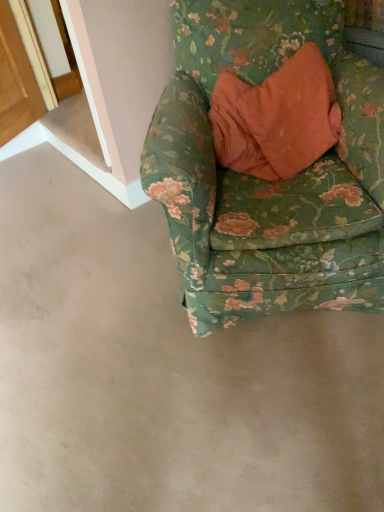
Question: Should I look upward or downward to see floral fabric chair at upper right?

Choices:
 (A) up
 (B) down

Answer: (A)

Question: Does gray concrete at lower center have a larger size compared to floral fabric chair at upper right?

Choices:
 (A) yes
 (B) no

Answer: (B)

Question: Is gray concrete at lower center shorter than floral fabric chair at upper right?

Choices:
 (A) yes
 (B) no

Answer: (A)

Question: Does gray concrete at lower center come in front of floral fabric chair at upper right?

Choices:
 (A) yes
 (B) no

Answer: (A)

Question: Is gray concrete at lower center looking in the opposite direction of floral fabric chair at upper right?

Choices:
 (A) no
 (B) yes

Answer: (A)

Question: From the image's perspective, does gray concrete at lower center appear higher than floral fabric chair at upper right?

Choices:
 (A) no
 (B) yes

Answer: (A)

Question: Can you confirm if gray concrete at lower center is positioned to the left of floral fabric chair at upper right?

Choices:
 (A) no
 (B) yes

Answer: (B)

Question: Would you say floral fabric chair at upper right is outside gray concrete at lower center?

Choices:
 (A) yes
 (B) no

Answer: (A)

Question: From a real-world perspective, is floral fabric chair at upper right physically above gray concrete at lower center?

Choices:
 (A) no
 (B) yes

Answer: (B)

Question: Would you say floral fabric chair at upper right is a long distance from gray concrete at lower center?

Choices:
 (A) yes
 (B) no

Answer: (B)

Question: From the image's perspective, is floral fabric chair at upper right over gray concrete at lower center?

Choices:
 (A) yes
 (B) no

Answer: (A)

Question: Can you confirm if floral fabric chair at upper right is taller than gray concrete at lower center?

Choices:
 (A) no
 (B) yes

Answer: (B)

Question: Is floral fabric chair at upper right positioned with its back to gray concrete at lower center?

Choices:
 (A) yes
 (B) no

Answer: (B)

Question: Looking at the image, does gray concrete at lower center seem bigger or smaller compared to floral fabric chair at upper right?

Choices:
 (A) small
 (B) big

Answer: (A)